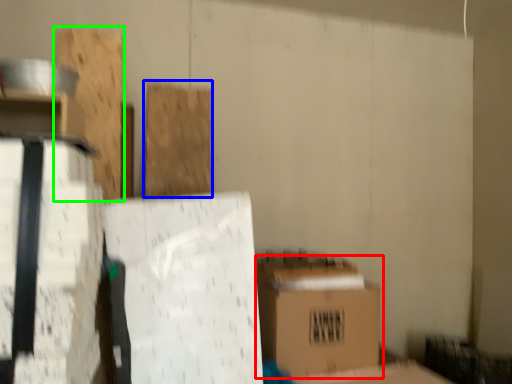
Question: Considering the real-world distances, which object is closest to box (highlighted by a red box)? wood (highlighted by a blue box) or wood (highlighted by a green box).

Choices:
 (A) wood
 (B) wood

Answer: (A)